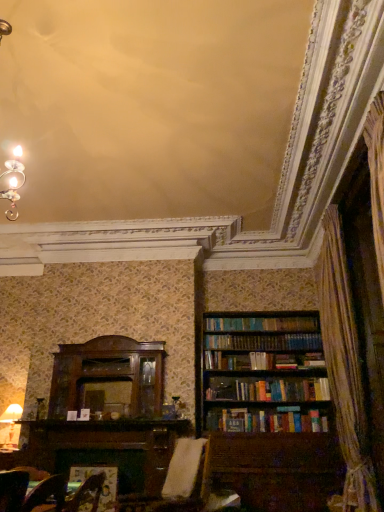
Describe the element at coordinates (10, 426) in the screenshot. I see `matte white lampshade at lower left` at that location.

Describe the element at coordinates (173, 482) in the screenshot. The height and width of the screenshot is (512, 384). I see `white fabric swivel chair at center` at that location.

At what (x,y) coordinates should I click in order to perform the action: click on brown wooden bookcase at right. Please return your answer as a coordinate pair (x, y). This screenshot has width=384, height=512. Looking at the image, I should click on (264, 373).

Could you tell me if brown wooden bookcase at right is turned towards matte white lampshade at lower left?

No, brown wooden bookcase at right is not oriented towards matte white lampshade at lower left.

Would you consider brown wooden bookcase at right to be distant from matte white lampshade at lower left?

Yes, brown wooden bookcase at right is far from matte white lampshade at lower left.

Which object is thinner, brown wooden bookcase at right or matte white lampshade at lower left?

matte white lampshade at lower left.

In the image, is brown wooden bookcase at right on the left side or the right side of velvet brown armchair at lower center?

In the image, brown wooden bookcase at right appears on the right side of velvet brown armchair at lower center.

Consider the image. Is brown wooden bookcase at right oriented towards velvet brown armchair at lower center?

No, brown wooden bookcase at right does not turn towards velvet brown armchair at lower center.

Is brown wooden bookcase at right bigger or smaller than velvet brown armchair at lower center?

Clearly, brown wooden bookcase at right is larger in size than velvet brown armchair at lower center.

From the image's perspective, which is above, brown wooden bookcase at right or velvet brown armchair at lower center?

brown wooden bookcase at right.

Between velvet brown armchair at lower center and white fabric swivel chair at center, which one has larger size?

white fabric swivel chair at center.

Is velvet brown armchair at lower center to the left of white fabric swivel chair at center from the viewer's perspective?

Indeed, velvet brown armchair at lower center is positioned on the left side of white fabric swivel chair at center.

Is point (96, 486) behind point (204, 445)?

No, (96, 486) is closer to viewer.

The image size is (384, 512). I want to click on swivel chair that appears on the right of velvet brown armchair at lower center, so click(173, 482).

From the picture: In terms of width, does brown wooden bookcase at right look wider or thinner when compared to white fabric swivel chair at center?

Considering their sizes, brown wooden bookcase at right looks broader than white fabric swivel chair at center.

Which is farther, (222, 396) or (195, 502)?

The point (222, 396) is more distant.

From a real-world perspective, is brown wooden bookcase at right over white fabric swivel chair at center?

Yes.

Is brown wooden bookcase at right in front of or behind white fabric swivel chair at center in the image?

Visually, brown wooden bookcase at right is located behind white fabric swivel chair at center.

Which object is more forward, matte white lampshade at lower left or white fabric swivel chair at center?

white fabric swivel chair at center is in front.

Considering the sizes of objects matte white lampshade at lower left and white fabric swivel chair at center in the image provided, who is wider, matte white lampshade at lower left or white fabric swivel chair at center?

white fabric swivel chair at center is wider.

Is the surface of matte white lampshade at lower left in direct contact with white fabric swivel chair at center?

matte white lampshade at lower left and white fabric swivel chair at center are clearly separated.

Is matte white lampshade at lower left facing away from white fabric swivel chair at center?

No.

Which object is closer to the camera, velvet brown armchair at lower center or brown wooden bookcase at right?

Positioned in front is velvet brown armchair at lower center.

Find the location of a particular element. This screenshot has width=384, height=512. bookcase behind the velvet brown armchair at lower center is located at coordinates (264, 373).

How many degrees apart are the facing directions of velvet brown armchair at lower center and brown wooden bookcase at right?

The angular difference between velvet brown armchair at lower center and brown wooden bookcase at right is 0.624 degrees.

Considering the relative sizes of velvet brown armchair at lower center and brown wooden bookcase at right in the image provided, is velvet brown armchair at lower center bigger than brown wooden bookcase at right?

Actually, velvet brown armchair at lower center might be smaller than brown wooden bookcase at right.

Between white fabric swivel chair at center and velvet brown armchair at lower center, which one has less height?

Result: velvet brown armchair at lower center is shorter.

Based on their sizes in the image, would you say white fabric swivel chair at center is bigger or smaller than velvet brown armchair at lower center?

Clearly, white fabric swivel chair at center is larger in size than velvet brown armchair at lower center.

Find the location of `swivel chair lying in front of the velvet brown armchair at lower center`. swivel chair lying in front of the velvet brown armchair at lower center is located at coordinates (173, 482).

Would you say white fabric swivel chair at center is a long distance from velvet brown armchair at lower center?

Yes, white fabric swivel chair at center and velvet brown armchair at lower center are located far from each other.

Find the location of `bookcase located on the right of matte white lampshade at lower left`. bookcase located on the right of matte white lampshade at lower left is located at coordinates (264, 373).

Where is `bookcase above the velvet brown armchair at lower center (from the image's perspective)`? bookcase above the velvet brown armchair at lower center (from the image's perspective) is located at coordinates (264, 373).

Which object lies nearer to the anchor point velvet brown armchair at lower center, white fabric swivel chair at center or brown wooden bookcase at right?

white fabric swivel chair at center.

From the image, which object appears to be nearer to matte white lampshade at lower left, brown wooden bookcase at right or velvet brown armchair at lower center?

velvet brown armchair at lower center is closer to matte white lampshade at lower left.

Looking at the image, which one is located closer to white fabric swivel chair at center, brown wooden bookcase at right or velvet brown armchair at lower center?

velvet brown armchair at lower center is positioned closer to the anchor white fabric swivel chair at center.

Looking at the image, which one is located further to white fabric swivel chair at center, brown wooden bookcase at right or matte white lampshade at lower left?

brown wooden bookcase at right is further to white fabric swivel chair at center.

Looking at the image, which one is located further to velvet brown armchair at lower center, matte white lampshade at lower left or white fabric swivel chair at center?

matte white lampshade at lower left lies further to velvet brown armchair at lower center than the other object.

Looking at the image, which one is located further to brown wooden bookcase at right, matte white lampshade at lower left or velvet brown armchair at lower center?

Based on the image, velvet brown armchair at lower center appears to be further to brown wooden bookcase at right.

Considering their positions, is velvet brown armchair at lower center positioned closer to brown wooden bookcase at right than white fabric swivel chair at center?

Based on the image, white fabric swivel chair at center appears to be nearer to brown wooden bookcase at right.

Based on their spatial positions, is matte white lampshade at lower left or brown wooden bookcase at right closer to white fabric swivel chair at center?

The object closer to white fabric swivel chair at center is matte white lampshade at lower left.

Find the location of a particular element. swivel chair located between matte white lampshade at lower left and brown wooden bookcase at right in the left-right direction is located at coordinates (173, 482).

In order to click on armchair between matte white lampshade at lower left and brown wooden bookcase at right in the horizontal direction in this screenshot , I will do `click(86, 495)`.

This screenshot has height=512, width=384. I want to click on swivel chair between velvet brown armchair at lower center and brown wooden bookcase at right in the horizontal direction, so click(173, 482).

Identify the location of armchair between matte white lampshade at lower left and white fabric swivel chair at center from left to right. Image resolution: width=384 pixels, height=512 pixels. (86, 495).